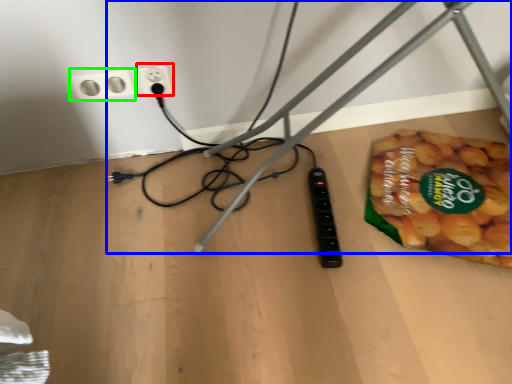
Question: Considering the real-world distances, which object is farthest from power plugs and sockets (highlighted by a red box)? wire (highlighted by a blue box) or power plugs and sockets (highlighted by a green box)?

Choices:
 (A) wire
 (B) power plugs and sockets

Answer: (A)